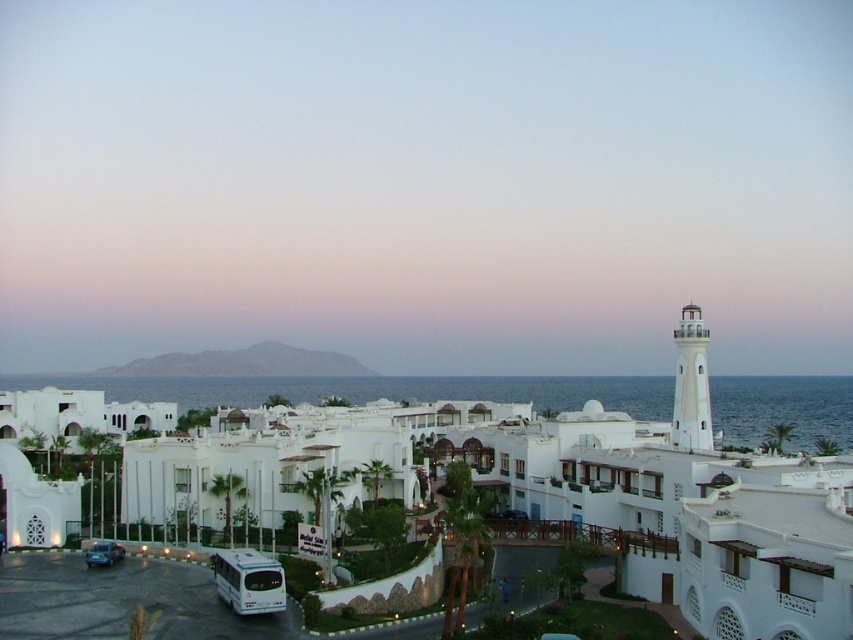
Question: Does white lighthouse at right appear on the right side of metallic blue car at lower left?

Choices:
 (A) yes
 (B) no

Answer: (A)

Question: Among these points, which one is nearest to the camera?

Choices:
 (A) (379, 243)
 (B) (115, 556)

Answer: (B)

Question: Can you confirm if white lighthouse at right is wider than metallic blue car at lower left?

Choices:
 (A) no
 (B) yes

Answer: (B)

Question: Does white lighthouse at right have a larger size compared to metallic blue car at lower left?

Choices:
 (A) yes
 (B) no

Answer: (A)

Question: Which of the following is the closest to the observer?

Choices:
 (A) (347, 284)
 (B) (85, 560)

Answer: (B)

Question: Among these points, which one is farthest from the camera?

Choices:
 (A) (112, 552)
 (B) (187, 33)

Answer: (B)